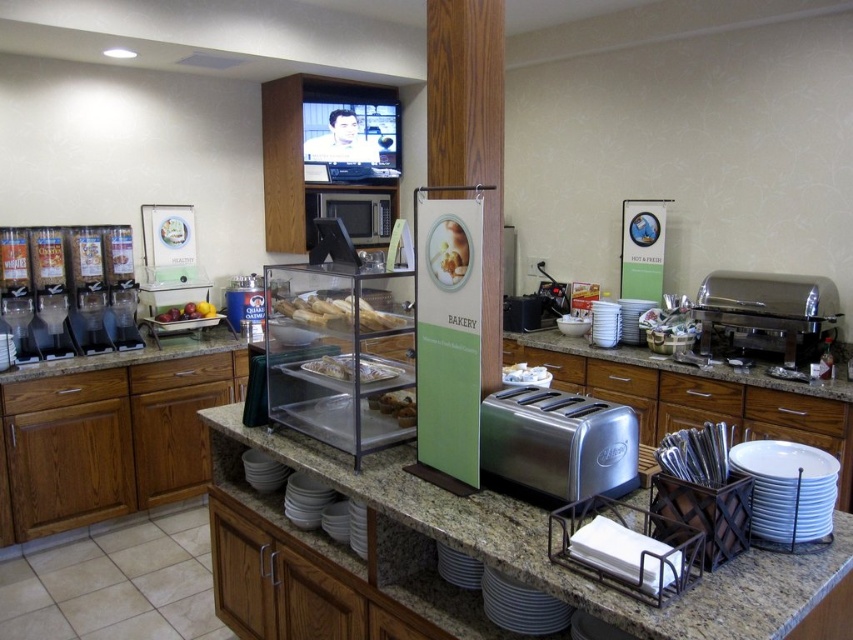
Is white ceramic plates at lower right above metallic microwave at center?

No, white ceramic plates at lower right is not above metallic microwave at center.

Can you confirm if white ceramic plates at lower right is shorter than metallic microwave at center?

Correct, white ceramic plates at lower right is not as tall as metallic microwave at center.

Image resolution: width=853 pixels, height=640 pixels. Find the location of `white ceramic plates at lower right`. white ceramic plates at lower right is located at coordinates [788, 488].

Can you confirm if stainless steel chafing dish at right is taller than wooden drawer at lower right?

Yes, stainless steel chafing dish at right is taller than wooden drawer at lower right.

Can you confirm if stainless steel chafing dish at right is positioned above wooden drawer at lower right?

Yes, stainless steel chafing dish at right is above wooden drawer at lower right.

Identify the location of stainless steel chafing dish at right. (767, 310).

Can you confirm if brown wood drawer at center is positioned above brushed metal drawer at center?

Incorrect, brown wood drawer at center is not positioned above brushed metal drawer at center.

Image resolution: width=853 pixels, height=640 pixels. Describe the element at coordinates (180, 372) in the screenshot. I see `brown wood drawer at center` at that location.

Identify the location of brown wood drawer at center. This screenshot has width=853, height=640. (180, 372).